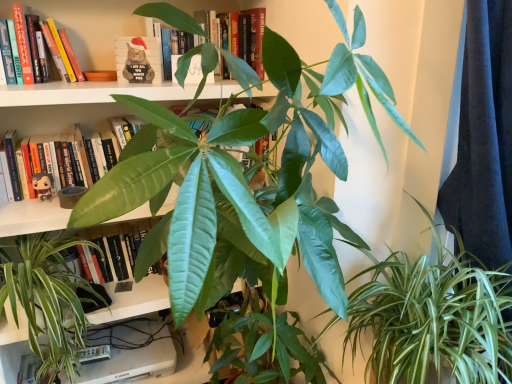
Question: Is green glossy leafy plant at center, the third houseplant from the right, inside matte black figurine at left, arranged as the first book when ordered from the bottom?

Choices:
 (A) no
 (B) yes

Answer: (A)

Question: Is there a large distance between matte black figurine at left, the third book when ordered from top to bottom, and green glossy leafy plant at center, which is counted as the 1th houseplant, starting from the left?

Choices:
 (A) no
 (B) yes

Answer: (A)

Question: Is matte black figurine at left, the third book when ordered from top to bottom, further to the viewer compared to green glossy leafy plant at center, the third houseplant from the right?

Choices:
 (A) no
 (B) yes

Answer: (B)

Question: Is matte black figurine at left, the third book when ordered from top to bottom, shorter than green glossy leafy plant at center, the third houseplant from the right?

Choices:
 (A) yes
 (B) no

Answer: (A)

Question: Is matte black figurine at left, the third book when ordered from top to bottom, to the left of green glossy leafy plant at center, the third houseplant from the right, from the viewer's perspective?

Choices:
 (A) yes
 (B) no

Answer: (B)

Question: From a real-world perspective, is matte black figurine at left, arranged as the first book when ordered from the bottom, positioned over green glossy leafy plant at center, which is counted as the 1th houseplant, starting from the left, based on gravity?

Choices:
 (A) no
 (B) yes

Answer: (B)

Question: Can you confirm if green matte leaf at upper center is taller than santa hat plush at upper center?

Choices:
 (A) no
 (B) yes

Answer: (A)

Question: Does green matte leaf at upper center contain santa hat plush at upper center?

Choices:
 (A) no
 (B) yes

Answer: (A)

Question: Is green matte leaf at upper center aimed at santa hat plush at upper center?

Choices:
 (A) yes
 (B) no

Answer: (B)

Question: Does green matte leaf at upper center come behind santa hat plush at upper center?

Choices:
 (A) yes
 (B) no

Answer: (A)

Question: Would you say green matte leaf at upper center is outside santa hat plush at upper center?

Choices:
 (A) yes
 (B) no

Answer: (A)

Question: Can you confirm if green matte leaf at upper center is positioned to the left of santa hat plush at upper center?

Choices:
 (A) no
 (B) yes

Answer: (A)

Question: Does green matte leaf at upper center turn towards matte black figurine at left?

Choices:
 (A) no
 (B) yes

Answer: (A)